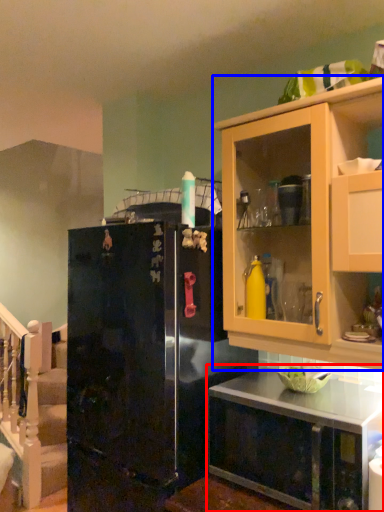
Question: Which of the following is the farthest to the observer, countertop (highlighted by a red box) or cabinetry (highlighted by a blue box)?

Choices:
 (A) countertop
 (B) cabinetry

Answer: (B)